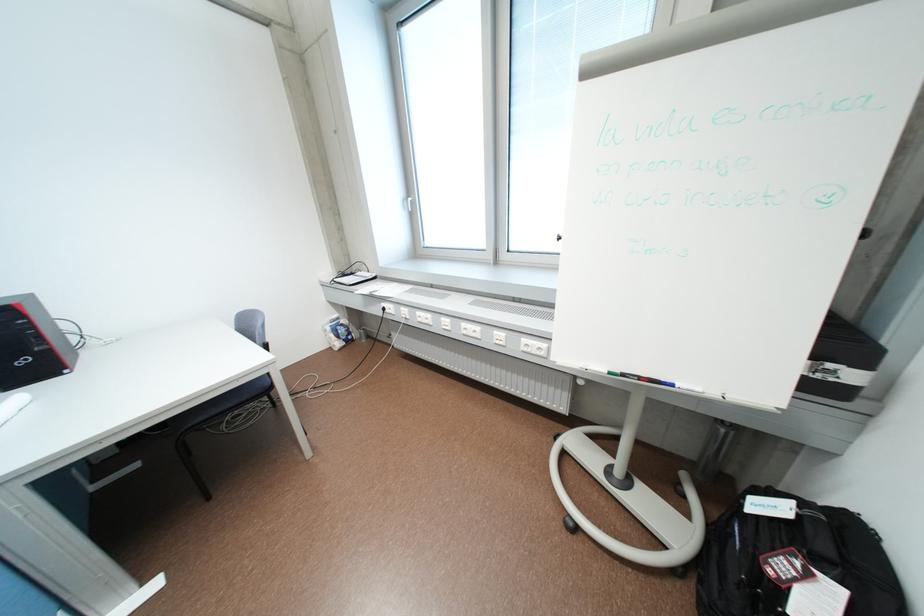
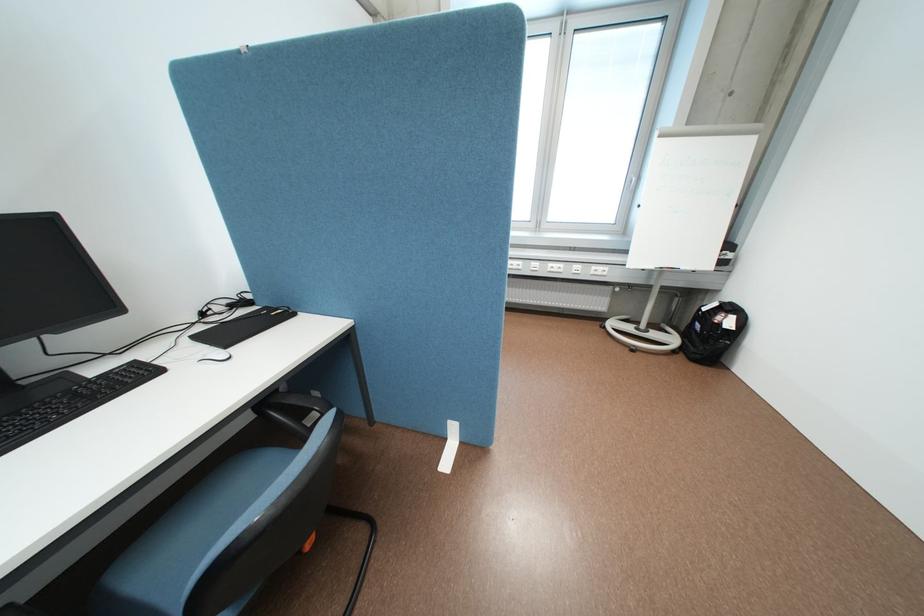
In the second image, find the point that corresponds to (x=536, y=339) in the first image.

(604, 267)